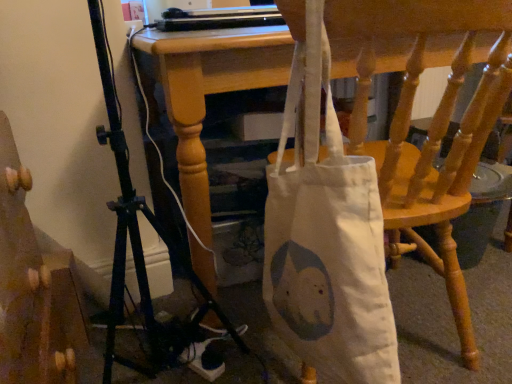
Question: Is white fabric bag at lower center aimed at wooden staircase at lower left?

Choices:
 (A) no
 (B) yes

Answer: (A)

Question: From the image's perspective, is white fabric bag at lower center on top of wooden staircase at lower left?

Choices:
 (A) yes
 (B) no

Answer: (A)

Question: Does white fabric bag at lower center come behind wooden staircase at lower left?

Choices:
 (A) yes
 (B) no

Answer: (A)

Question: Does white fabric bag at lower center have a larger size compared to wooden staircase at lower left?

Choices:
 (A) yes
 (B) no

Answer: (A)

Question: Is white fabric bag at lower center not within wooden staircase at lower left?

Choices:
 (A) no
 (B) yes

Answer: (B)

Question: Is white fabric bag at lower center facing away from wooden staircase at lower left?

Choices:
 (A) no
 (B) yes

Answer: (A)

Question: Can you confirm if wooden staircase at lower left is bigger than white fabric bag at lower center?

Choices:
 (A) yes
 (B) no

Answer: (B)

Question: Is wooden staircase at lower left at the left side of white fabric bag at lower center?

Choices:
 (A) yes
 (B) no

Answer: (A)

Question: Is wooden staircase at lower left further to the viewer compared to white fabric bag at lower center?

Choices:
 (A) yes
 (B) no

Answer: (B)

Question: From a real-world perspective, is wooden staircase at lower left positioned over white fabric bag at lower center based on gravity?

Choices:
 (A) yes
 (B) no

Answer: (A)

Question: Is wooden staircase at lower left not inside white fabric bag at lower center?

Choices:
 (A) yes
 (B) no

Answer: (A)

Question: Are wooden staircase at lower left and white fabric bag at lower center located far from each other?

Choices:
 (A) no
 (B) yes

Answer: (A)

Question: From a real-world perspective, relative to wooden staircase at lower left, is white fabric bag at lower center vertically above or below?

Choices:
 (A) above
 (B) below

Answer: (B)